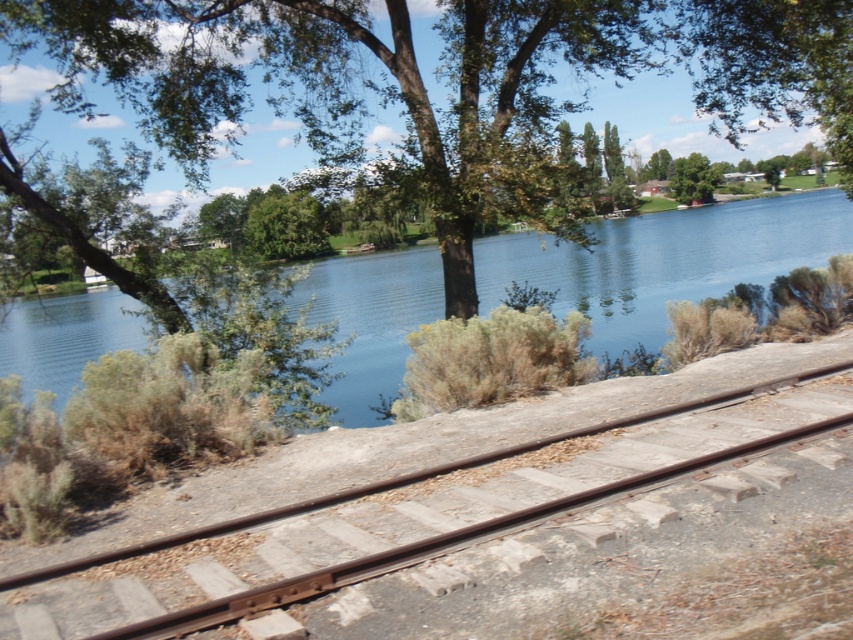
Question: Does smooth metal train track at center have a smaller size compared to blue water at center?

Choices:
 (A) yes
 (B) no

Answer: (A)

Question: Which of the following is the farthest from the observer?

Choices:
 (A) (560, 484)
 (B) (656, 312)

Answer: (B)

Question: Which object appears closest to the camera in this image?

Choices:
 (A) blue water at center
 (B) smooth metal train track at center

Answer: (B)

Question: Does smooth metal train track at center have a greater width compared to blue water at center?

Choices:
 (A) no
 (B) yes

Answer: (A)

Question: Does smooth metal train track at center appear over blue water at center?

Choices:
 (A) yes
 (B) no

Answer: (B)